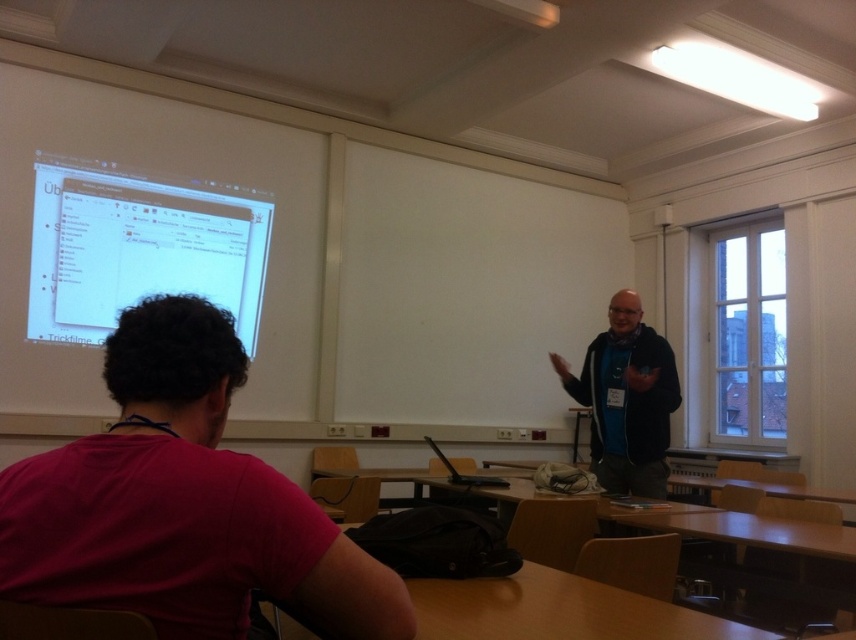
You are a student sitting at the desk in the classroom. You notice two points marked on the projection screen. Which point, point (103,433) or point (670,353), is closer to you?

Point (103,433) is closer to you because it is further to the viewer than point (670,353).

You are standing in the classroom and want to determine which of the two points, point (x=60, y=193) or point (x=648, y=442), is closer to you. Based on the scene, which point is nearer?

Point (x=60, y=193) is closer to you because it is further to the viewer than point (x=648, y=442).